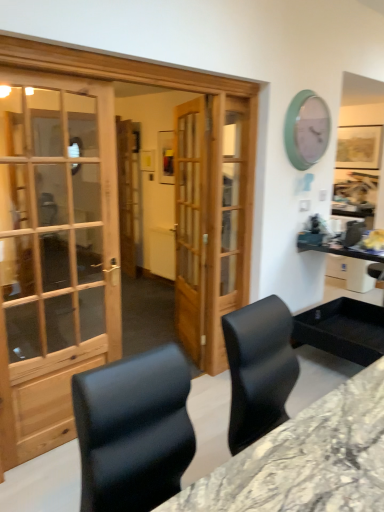
Measure the distance between point (370, 394) and camera.

A distance of 5.17 feet exists between point (370, 394) and camera.

In order to click on wooden door at center in this screenshot , I will do `click(191, 224)`.

Find the location of a particular element. This screenshot has width=384, height=512. desk lying in front of the teal plastic clock at upper right is located at coordinates (306, 459).

From the image's perspective, relative to teal plastic clock at upper right, is marble/black desk at center above or below?

Based on their image positions, marble/black desk at center is located beneath teal plastic clock at upper right.

Looking at this image, which is closer to the camera, (x=368, y=415) or (x=295, y=151)?

Point (x=368, y=415).

How much distance is there between marble/black desk at center and teal plastic clock at upper right?

A distance of 6.88 feet exists between marble/black desk at center and teal plastic clock at upper right.

How far apart are wooden door at center and teal plastic clock at upper right?

wooden door at center is 93.21 centimeters away from teal plastic clock at upper right.

Does point (194, 342) come in front of point (288, 125)?

No, it is behind (288, 125).

Would you say wooden door at center is outside teal plastic clock at upper right?

Indeed, wooden door at center is completely outside teal plastic clock at upper right.

Considering the relative sizes of wooden door at center and teal plastic clock at upper right in the image provided, is wooden door at center smaller than teal plastic clock at upper right?

Actually, wooden door at center might be larger than teal plastic clock at upper right.

Is teal plastic clock at upper right turned away from marble/black desk at center?

No, marble/black desk at center is not at the back of teal plastic clock at upper right.

I want to click on desk on the left of teal plastic clock at upper right, so click(x=306, y=459).

How different are the orientations of teal plastic clock at upper right and marble/black desk at center in degrees?

There is a 92-degree angle between the facing directions of teal plastic clock at upper right and marble/black desk at center.

Is teal plastic clock at upper right positioned far away from marble/black desk at center?

Indeed, teal plastic clock at upper right is not near marble/black desk at center.

Considering the sizes of wooden door at center and marble/black desk at center in the image, is wooden door at center taller or shorter than marble/black desk at center?

wooden door at center is taller than marble/black desk at center.

Considering the points (191, 147) and (352, 420), which point is behind, point (191, 147) or point (352, 420)?

The point (191, 147) is more distant.

Considering the sizes of objects wooden door at center and marble/black desk at center in the image provided, who is thinner, wooden door at center or marble/black desk at center?

wooden door at center is thinner.

From a real-world perspective, between wooden door at center and marble/black desk at center, who is vertically higher?

In real-world perspective, wooden door at center is above.

Is teal plastic clock at upper right directly adjacent to wooden door at center?

teal plastic clock at upper right is not next to wooden door at center, and they're not touching.

Where is `clock above the wooden door at center (from the image's perspective)`? This screenshot has height=512, width=384. clock above the wooden door at center (from the image's perspective) is located at coordinates (306, 129).

Is teal plastic clock at upper right turned away from wooden door at center?

No, teal plastic clock at upper right is not facing the opposite direction of wooden door at center.

From the image's perspective, is teal plastic clock at upper right below wooden door at center?

No, from the image's perspective, teal plastic clock at upper right is not beneath wooden door at center.

Is marble/black desk at center thinner than wooden door at center?

No, marble/black desk at center is not thinner than wooden door at center.

How different are the orientations of marble/black desk at center and wooden door at center in degrees?

The angle between the facing direction of marble/black desk at center and the facing direction of wooden door at center is 2.1 degrees.

Are marble/black desk at center and wooden door at center located far from each other?

Yes, marble/black desk at center is far from wooden door at center.

Is marble/black desk at center to the left of wooden door at center from the viewer's perspective?

No.

Find the location of `clock above the marble/black desk at center (from a real-world perspective)`. clock above the marble/black desk at center (from a real-world perspective) is located at coordinates (306, 129).

Find the location of `door in front of the teal plastic clock at upper right`. door in front of the teal plastic clock at upper right is located at coordinates (191, 224).

Looking at the image, which one is located further to teal plastic clock at upper right, wooden door at center or marble/black desk at center?

Among the two, marble/black desk at center is located further to teal plastic clock at upper right.

Which object lies further to the anchor point marble/black desk at center, teal plastic clock at upper right or wooden door at center?

The object further to marble/black desk at center is teal plastic clock at upper right.

Which object lies nearer to the anchor point marble/black desk at center, wooden door at center or teal plastic clock at upper right?

wooden door at center.

Based on their spatial positions, is marble/black desk at center or wooden door at center closer to teal plastic clock at upper right?

The object closer to teal plastic clock at upper right is wooden door at center.

Based on their spatial positions, is teal plastic clock at upper right or marble/black desk at center further from wooden door at center?

marble/black desk at center lies further to wooden door at center than the other object.

Which object lies nearer to the anchor point wooden door at center, marble/black desk at center or teal plastic clock at upper right?

teal plastic clock at upper right is positioned closer to the anchor wooden door at center.

The image size is (384, 512). Identify the location of door between marble/black desk at center and teal plastic clock at upper right in the front-back direction. (191, 224).